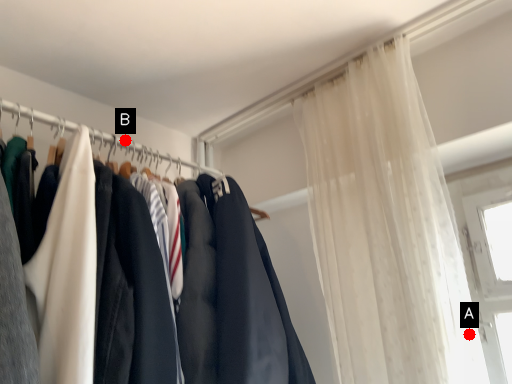
Question: Two points are circled on the image, labeled by A and B beside each circle. Which of the following is the farthest from the observer?

Choices:
 (A) A is further
 (B) B is further

Answer: (B)